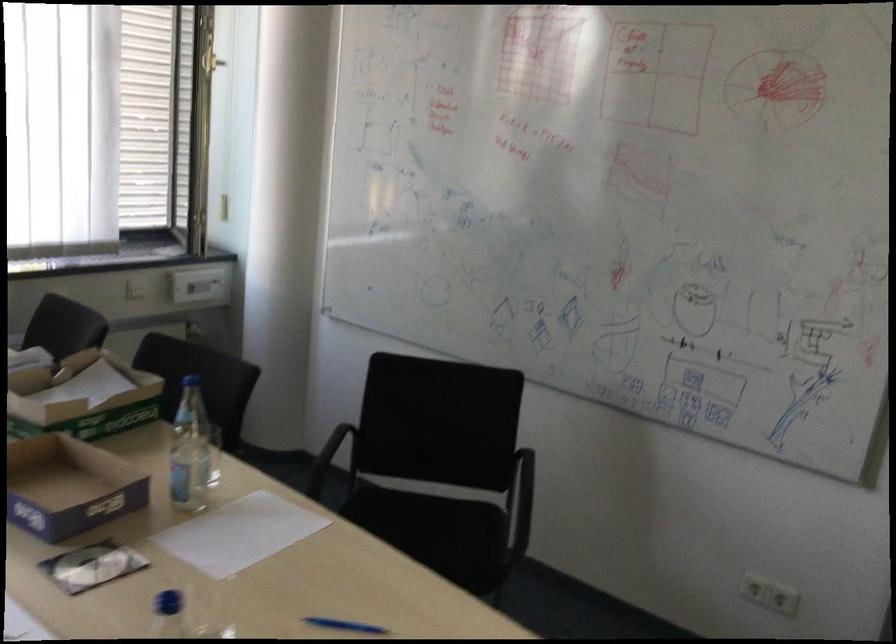
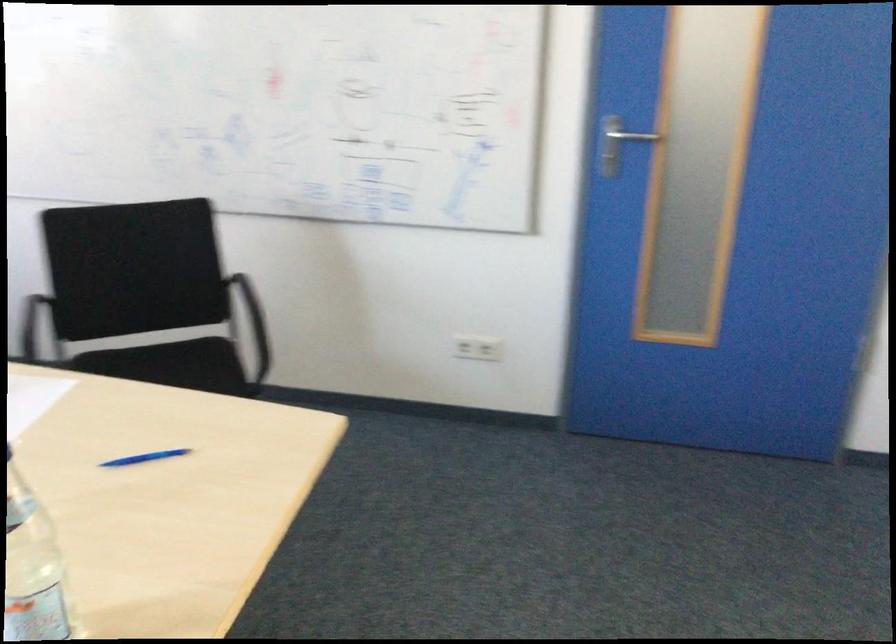
In the second image, find the point that corresponds to pixel 454 529 in the first image.

(194, 364)